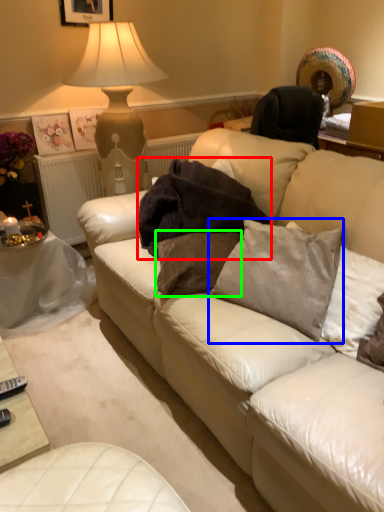
Question: Which is farther away from blanket (highlighted by a red box)? pillow (highlighted by a blue box) or pillow (highlighted by a green box)?

Choices:
 (A) pillow
 (B) pillow

Answer: (A)